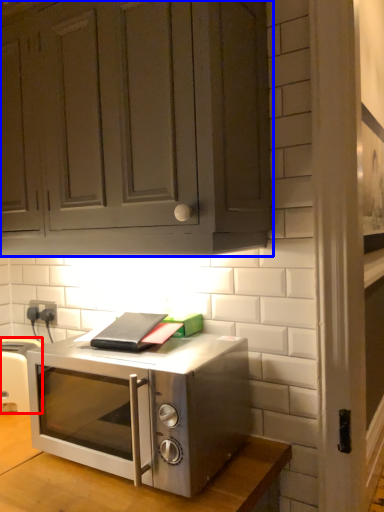
Question: Which object is further to the camera taking this photo, appliance (highlighted by a red box) or cabinetry (highlighted by a blue box)?

Choices:
 (A) appliance
 (B) cabinetry

Answer: (A)